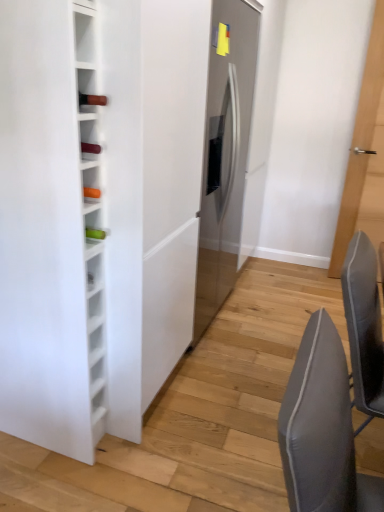
At what (x,y) coordinates should I click in order to perform the action: click on light brown wooden door at right. Please return your answer as a coordinate pair (x, y). This screenshot has width=384, height=512. Looking at the image, I should click on (371, 81).

Locate an element on the screen. The image size is (384, 512). white glass wine rack at left is located at coordinates (51, 227).

Locate an element on the screen. gray fabric chair at lower right is located at coordinates (322, 429).

The width and height of the screenshot is (384, 512). Describe the element at coordinates (322, 429) in the screenshot. I see `gray fabric chair at lower right` at that location.

Image resolution: width=384 pixels, height=512 pixels. What do you see at coordinates (225, 152) in the screenshot? I see `satin silver refrigerator at center` at bounding box center [225, 152].

Identify the location of light brown wooden door at right. (371, 81).

Is white glass wine rack at left to the left or to the right of gray fabric chair at lower right in the image?

white glass wine rack at left is to the left of gray fabric chair at lower right.

From their relative heights in the image, would you say white glass wine rack at left is taller or shorter than gray fabric chair at lower right?

In the image, white glass wine rack at left appears to be taller than gray fabric chair at lower right.

Identify the location of chair located on the right of white glass wine rack at left. The width and height of the screenshot is (384, 512). (322, 429).

Between point (52, 90) and point (210, 112), which one is positioned behind?

The point (210, 112) is behind.

Is the depth of white glass wine rack at left less than that of satin silver refrigerator at center?

Yes, white glass wine rack at left is closer to the viewer.

Can you confirm if white glass wine rack at left is bigger than satin silver refrigerator at center?

No.

Does white glass wine rack at left have a lesser height compared to satin silver refrigerator at center?

Yes.

Could gray fabric chair at lower right be considered to be inside light brown wooden door at right?

No, gray fabric chair at lower right is not surrounded by light brown wooden door at right.

Is light brown wooden door at right smaller than gray fabric chair at lower right?

Correct, light brown wooden door at right occupies less space than gray fabric chair at lower right.

Considering the sizes of objects light brown wooden door at right and gray fabric chair at lower right in the image provided, who is thinner, light brown wooden door at right or gray fabric chair at lower right?

Thinner between the two is light brown wooden door at right.

Which of these two, light brown wooden door at right or gray fabric chair at lower right, stands taller?

Standing taller between the two is light brown wooden door at right.

Is gray fabric chair at lower right positioned far away from light brown wooden door at right?

Yes, gray fabric chair at lower right and light brown wooden door at right are located far from each other.

Considering the relative sizes of gray fabric chair at lower right and light brown wooden door at right in the image provided, is gray fabric chair at lower right smaller than light brown wooden door at right?

No, gray fabric chair at lower right is not smaller than light brown wooden door at right.

Which object is further away from the camera taking this photo, gray fabric chair at lower right or light brown wooden door at right?

light brown wooden door at right is further away from the camera.

Considering the relative positions of gray fabric chair at lower right and light brown wooden door at right in the image provided, is gray fabric chair at lower right to the left or to the right of light brown wooden door at right?

gray fabric chair at lower right is to the left of light brown wooden door at right.

Is the position of light brown wooden door at right less distant than that of satin silver refrigerator at center?

No, light brown wooden door at right is further to the viewer.

Does light brown wooden door at right appear on the left side of satin silver refrigerator at center?

In fact, light brown wooden door at right is to the right of satin silver refrigerator at center.

Locate an element on the screen. The image size is (384, 512). fridge that appears below the light brown wooden door at right (from the image's perspective) is located at coordinates coord(225,152).

Does point (355, 172) come in front of point (207, 255)?

No.

Considering the positions of points (372, 128) and (43, 17), is point (372, 128) farther from camera compared to point (43, 17)?

Yes, point (372, 128) is behind point (43, 17).

Could you tell me if light brown wooden door at right is facing white glass wine rack at left?

No, light brown wooden door at right is not facing towards white glass wine rack at left.

Does light brown wooden door at right have a larger size compared to white glass wine rack at left?

Incorrect, light brown wooden door at right is not larger than white glass wine rack at left.

From a real-world perspective, relative to white glass wine rack at left, is light brown wooden door at right vertically above or below?

light brown wooden door at right is situated higher than white glass wine rack at left in the real world.

From the image's perspective, who appears lower, satin silver refrigerator at center or light brown wooden door at right?

satin silver refrigerator at center is shown below in the image.

Is satin silver refrigerator at center oriented away from light brown wooden door at right?

No, satin silver refrigerator at center is not facing away from light brown wooden door at right.

Between satin silver refrigerator at center and light brown wooden door at right, which one has larger size?

satin silver refrigerator at center.

Considering the sizes of satin silver refrigerator at center and light brown wooden door at right in the image, is satin silver refrigerator at center taller or shorter than light brown wooden door at right?

In the image, satin silver refrigerator at center appears to be shorter than light brown wooden door at right.

The width and height of the screenshot is (384, 512). Find the location of `furniture to the left of gray fabric chair at lower right`. furniture to the left of gray fabric chair at lower right is located at coordinates [51, 227].

I want to click on fridge on the right of white glass wine rack at left, so click(x=225, y=152).

Considering their positions, is white glass wine rack at left positioned closer to gray fabric chair at lower right than light brown wooden door at right?

Among the two, white glass wine rack at left is located nearer to gray fabric chair at lower right.

Looking at the image, which one is located further to light brown wooden door at right, satin silver refrigerator at center or gray fabric chair at lower right?

gray fabric chair at lower right is further to light brown wooden door at right.

Estimate the real-world distances between objects in this image. Which object is further from white glass wine rack at left, satin silver refrigerator at center or gray fabric chair at lower right?

The object further to white glass wine rack at left is satin silver refrigerator at center.

From the image, which object appears to be nearer to gray fabric chair at lower right, satin silver refrigerator at center or light brown wooden door at right?

satin silver refrigerator at center.

Considering their positions, is satin silver refrigerator at center positioned further to white glass wine rack at left than light brown wooden door at right?

light brown wooden door at right lies further to white glass wine rack at left than the other object.

Based on the photo, estimate the real-world distances between objects in this image. Which object is closer to satin silver refrigerator at center, white glass wine rack at left or gray fabric chair at lower right?

white glass wine rack at left lies closer to satin silver refrigerator at center than the other object.

Considering their positions, is gray fabric chair at lower right positioned closer to satin silver refrigerator at center than white glass wine rack at left?

white glass wine rack at left.

Based on their spatial positions, is satin silver refrigerator at center or white glass wine rack at left closer to light brown wooden door at right?

Among the two, satin silver refrigerator at center is located nearer to light brown wooden door at right.

The width and height of the screenshot is (384, 512). Find the location of `fridge between white glass wine rack at left and light brown wooden door at right`. fridge between white glass wine rack at left and light brown wooden door at right is located at coordinates (225, 152).

You are a GUI agent. You are given a task and a screenshot of the screen. Output one action in this format:
    pyautogui.click(x=<x>, y=<y>)
    Task: Click on the furniture between satin silver refrigerator at center and gray fabric chair at lower right in the vertical direction
    Image resolution: width=384 pixels, height=512 pixels.
    Given the screenshot: What is the action you would take?
    pyautogui.click(x=51, y=227)

In order to click on furniture between gray fabric chair at lower right and light brown wooden door at right along the z-axis in this screenshot , I will do click(51, 227).

This screenshot has height=512, width=384. In order to click on fridge between gray fabric chair at lower right and light brown wooden door at right in the front-back direction in this screenshot , I will do `click(225, 152)`.